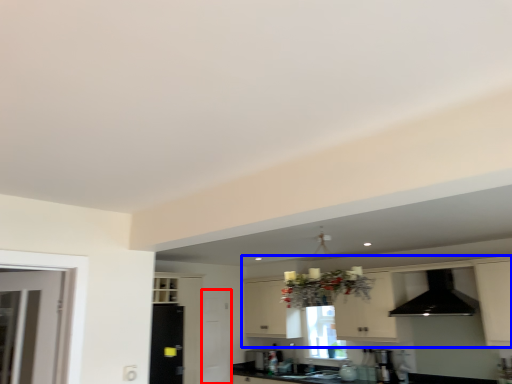
Question: Which point is closer to the camera, screen door (highlighted by a red box) or cabinetry (highlighted by a blue box)?

Choices:
 (A) screen door
 (B) cabinetry

Answer: (B)